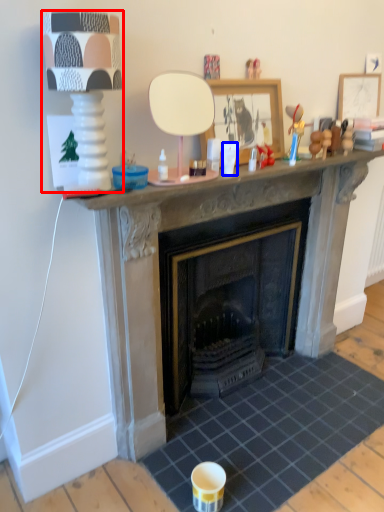
Question: Which point is further to the camera, lamp (highlighted by a red box) or coffee cup (highlighted by a blue box)?

Choices:
 (A) lamp
 (B) coffee cup

Answer: (B)